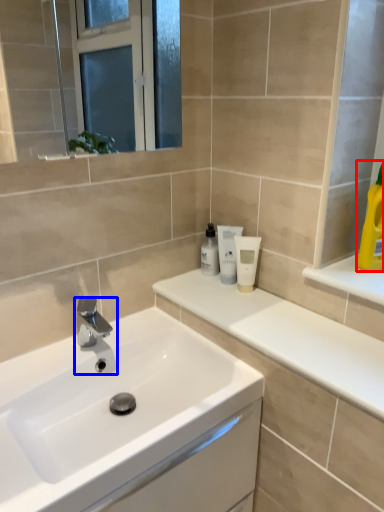
Question: Which point is further to the camera, cleaning product (highlighted by a red box) or tap (highlighted by a blue box)?

Choices:
 (A) cleaning product
 (B) tap

Answer: (B)